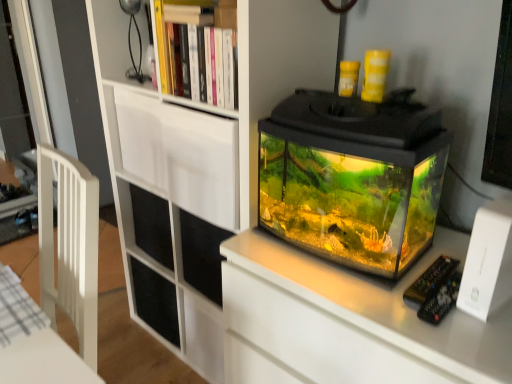
The image size is (512, 384). What do you see at coordinates (181, 155) in the screenshot? I see `white matte drawer at upper center` at bounding box center [181, 155].

Where is `white matte bookcase at upper center`? The width and height of the screenshot is (512, 384). white matte bookcase at upper center is located at coordinates (168, 197).

Measure the distance between white matte bookcase at upper center and camera.

The depth of white matte bookcase at upper center is 39.30 inches.

Identify the location of transparent glass tank at center. The image size is (512, 384). (352, 178).

Considering the relative positions of white matte bookcase at upper center and transparent glass tank at center in the image provided, is white matte bookcase at upper center to the right of transparent glass tank at center from the viewer's perspective?

Incorrect, white matte bookcase at upper center is not on the right side of transparent glass tank at center.

Is white matte bookcase at upper center facing towards transparent glass tank at center?

No, white matte bookcase at upper center does not turn towards transparent glass tank at center.

From the picture: Is white matte bookcase at upper center far from transparent glass tank at center?

white matte bookcase at upper center is actually quite close to transparent glass tank at center.

From the picture: Are transparent glass tank at center and wooden bookshelf at upper center far apart?

No, transparent glass tank at center is not far from wooden bookshelf at upper center.

From a real-world perspective, which is physically above, transparent glass tank at center or wooden bookshelf at upper center?

wooden bookshelf at upper center is physically above.

In the scene shown: Is transparent glass tank at center looking in the opposite direction of wooden bookshelf at upper center?

That's not correct — transparent glass tank at center is not looking away from wooden bookshelf at upper center.

Is transparent glass tank at center closer to camera compared to wooden bookshelf at upper center?

That is True.

Considering the sizes of objects transparent glass tank at center and white matte bookcase at upper center in the image provided, who is smaller, transparent glass tank at center or white matte bookcase at upper center?

transparent glass tank at center.

In terms of height, does transparent glass tank at center look taller or shorter compared to white matte bookcase at upper center?

transparent glass tank at center is shorter than white matte bookcase at upper center.

Is transparent glass tank at center wider than white matte bookcase at upper center?

In fact, transparent glass tank at center might be narrower than white matte bookcase at upper center.

Is transparent glass tank at center turned away from white matte bookcase at upper center?

No, transparent glass tank at center's orientation is not away from white matte bookcase at upper center.

From a real-world perspective, between wooden bookshelf at upper center and white matte drawer at upper center, who is vertically lower?

In real-world perspective, white matte drawer at upper center is lower.

Does wooden bookshelf at upper center have a greater height compared to white matte drawer at upper center?

Incorrect, the height of wooden bookshelf at upper center is not larger of that of white matte drawer at upper center.

Considering the relative sizes of wooden bookshelf at upper center and white matte drawer at upper center in the image provided, is wooden bookshelf at upper center bigger than white matte drawer at upper center?

No.

From the image's perspective, does wooden bookshelf at upper center appear higher than transparent glass tank at center?

Yes, from the image's perspective, wooden bookshelf at upper center is on top of transparent glass tank at center.

You are a GUI agent. You are given a task and a screenshot of the screen. Output one action in this format:
    pyautogui.click(x=<x>, y=<y>)
    Task: Click on the shelf to the left of transparent glass tank at center
    Image resolution: width=512 pixels, height=384 pixels.
    Given the screenshot: What is the action you would take?
    pyautogui.click(x=196, y=51)

Is wooden bookshelf at upper center oriented away from transparent glass tank at center?

wooden bookshelf at upper center does not have its back to transparent glass tank at center.

Is wooden bookshelf at upper center not within transparent glass tank at center?

Yes, wooden bookshelf at upper center is outside of transparent glass tank at center.

In the scene shown: Based on their positions, is white matte drawer at upper center located to the left or right of wooden bookshelf at upper center?

In the image, white matte drawer at upper center appears on the left side of wooden bookshelf at upper center.

Is white matte drawer at upper center wider than wooden bookshelf at upper center?

Yes.

Is white matte drawer at upper center positioned with its back to wooden bookshelf at upper center?

No, white matte drawer at upper center is not facing the opposite direction of wooden bookshelf at upper center.

Which is in front, point (148, 176) or point (222, 65)?

Positioned in front is point (222, 65).

Is white matte bookcase at upper center positioned beyond the bounds of white matte drawer at upper center?

Yes, white matte bookcase at upper center is located beyond the bounds of white matte drawer at upper center.

Considering the positions of points (203, 360) and (231, 133), is point (203, 360) closer to camera compared to point (231, 133)?

No, it is behind (231, 133).

In the scene shown: Is white matte bookcase at upper center beside white matte drawer at upper center?

There is a gap between white matte bookcase at upper center and white matte drawer at upper center.

The height and width of the screenshot is (384, 512). In order to click on glass box positioned vertically above the white matte bookcase at upper center (from a real-world perspective) in this screenshot , I will do `click(352, 178)`.

In the image, there is a wooden bookshelf at upper center. At what (x,y) coordinates should I click in order to perform the action: click on glass box below it (from the image's perspective). Please return your answer as a coordinate pair (x, y). Looking at the image, I should click on (352, 178).

Looking at the image, which one is located further to white matte drawer at upper center, wooden bookshelf at upper center or white matte bookcase at upper center?

Based on the image, wooden bookshelf at upper center appears to be further to white matte drawer at upper center.

Considering their positions, is transparent glass tank at center positioned closer to white matte bookcase at upper center than wooden bookshelf at upper center?

wooden bookshelf at upper center is positioned closer to the anchor white matte bookcase at upper center.

Estimate the real-world distances between objects in this image. Which object is closer to transparent glass tank at center, white matte bookcase at upper center or white matte drawer at upper center?

The object closer to transparent glass tank at center is white matte drawer at upper center.

From the picture: Estimate the real-world distances between objects in this image. Which object is closer to white matte drawer at upper center, transparent glass tank at center or white matte bookcase at upper center?

Among the two, white matte bookcase at upper center is located nearer to white matte drawer at upper center.

Based on their spatial positions, is wooden bookshelf at upper center or white matte bookcase at upper center further from transparent glass tank at center?

Among the two, white matte bookcase at upper center is located further to transparent glass tank at center.

Looking at the image, which one is located further to wooden bookshelf at upper center, transparent glass tank at center or white matte bookcase at upper center?

Based on the image, transparent glass tank at center appears to be further to wooden bookshelf at upper center.

Considering their positions, is wooden bookshelf at upper center positioned closer to white matte drawer at upper center than transparent glass tank at center?

Among the two, wooden bookshelf at upper center is located nearer to white matte drawer at upper center.

Estimate the real-world distances between objects in this image. Which object is closer to white matte bookcase at upper center, wooden bookshelf at upper center or white matte drawer at upper center?

The object closer to white matte bookcase at upper center is white matte drawer at upper center.

You are a GUI agent. You are given a task and a screenshot of the screen. Output one action in this format:
    pyautogui.click(x=<x>, y=<y>)
    Task: Click on the bookcase between white matte drawer at upper center and transparent glass tank at center from left to right
    The image size is (512, 384).
    Given the screenshot: What is the action you would take?
    pyautogui.click(x=168, y=197)

The width and height of the screenshot is (512, 384). In order to click on drawer that lies between wooden bookshelf at upper center and white matte bookcase at upper center from top to bottom in this screenshot , I will do `click(181, 155)`.

Image resolution: width=512 pixels, height=384 pixels. I want to click on shelf between white matte drawer at upper center and transparent glass tank at center from left to right, so click(x=196, y=51).

Identify the location of bookcase between wooden bookshelf at upper center and transparent glass tank at center. (168, 197).